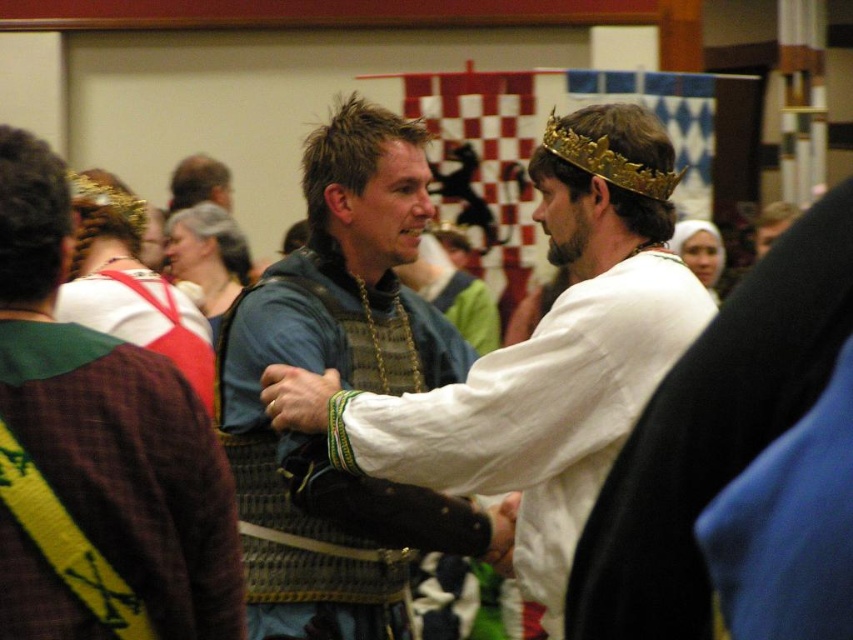
Does matte blue armor at center have a smaller size compared to gold metallic crown at center?

No.

Who is positioned more to the left, matte blue armor at center or gold metallic crown at center?

From the viewer's perspective, matte blue armor at center appears more on the left side.

Identify the location of matte blue armor at center. This screenshot has width=853, height=640. (541, 355).

Where is `matte blue armor at center`? matte blue armor at center is located at coordinates (541, 355).

Looking at this image, which is below, green fabric sash at left or white fabric crown at center?

green fabric sash at left is below.

Is point (10, 296) in front of point (778, 228)?

That is True.

Consider the image. Who is more forward, (18, 378) or (767, 211)?

Point (18, 378) is more forward.

You are a GUI agent. You are given a task and a screenshot of the screen. Output one action in this format:
    pyautogui.click(x=<x>, y=<y>)
    Task: Click on the green fabric sash at left
    Image resolution: width=853 pixels, height=640 pixels.
    Given the screenshot: What is the action you would take?
    pyautogui.click(x=109, y=420)

Is matte blue armor at center smaller than white fabric crown at center?

No, matte blue armor at center is not smaller than white fabric crown at center.

Describe the element at coordinates (541, 355) in the screenshot. I see `matte blue armor at center` at that location.

Does point (593, 292) lie in front of point (798, 216)?

Yes, point (593, 292) is in front of point (798, 216).

The height and width of the screenshot is (640, 853). I want to click on matte blue armor at center, so click(541, 355).